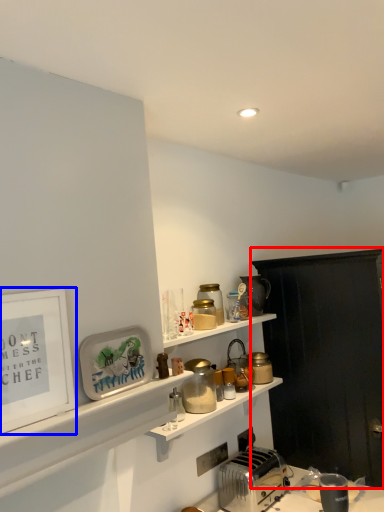
Question: Which object is closer to the camera taking this photo, cabinetry (highlighted by a red box) or picture frame (highlighted by a blue box)?

Choices:
 (A) cabinetry
 (B) picture frame

Answer: (B)